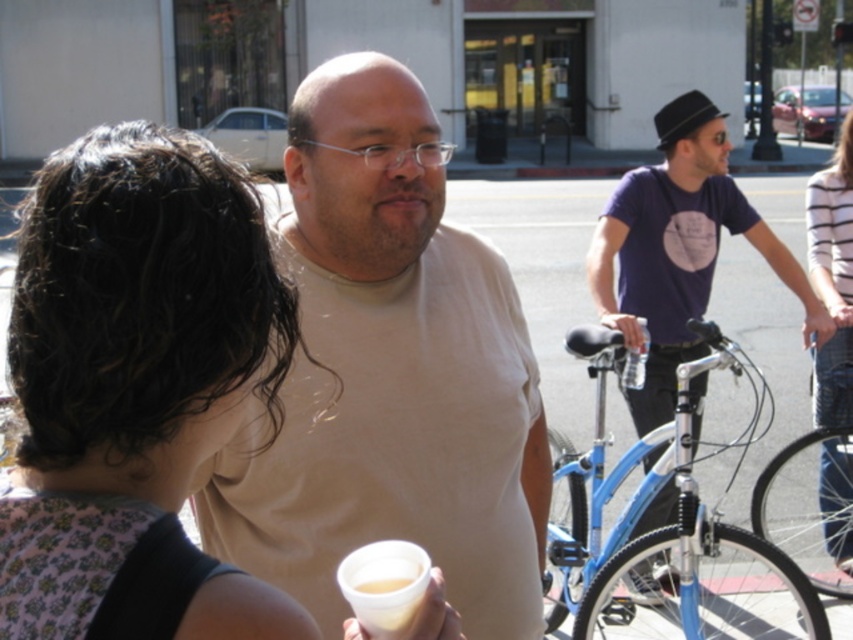
Which is behind, point (289, 140) or point (821, 609)?

The point (821, 609) is more distant.

Based on the photo, does beige t-shirt at center lie in front of blue metallic bicycle at center-right?

That is True.

You are a GUI agent. You are given a task and a screenshot of the screen. Output one action in this format:
    pyautogui.click(x=<x>, y=<y>)
    Task: Click on the beige t-shirt at center
    The height and width of the screenshot is (640, 853).
    Given the screenshot: What is the action you would take?
    pyautogui.click(x=390, y=374)

Where is `beige t-shirt at center`? Image resolution: width=853 pixels, height=640 pixels. beige t-shirt at center is located at coordinates (390, 374).

Is blue metallic bicycle at center-right bigger than striped cotton shirt at right?

Yes, blue metallic bicycle at center-right is bigger than striped cotton shirt at right.

Which is in front, point (682, 420) or point (839, 406)?

Point (682, 420) is more forward.

The width and height of the screenshot is (853, 640). I want to click on blue metallic bicycle at center-right, so click(x=670, y=528).

Is beige t-shirt at center to the left of translucent plastic cup at lower center from the viewer's perspective?

Incorrect, beige t-shirt at center is not on the left side of translucent plastic cup at lower center.

Who is more forward, (x=397, y=221) or (x=361, y=547)?

Point (x=361, y=547) is in front.

Describe the element at coordinates (390, 374) in the screenshot. I see `beige t-shirt at center` at that location.

This screenshot has width=853, height=640. I want to click on beige t-shirt at center, so click(x=390, y=374).